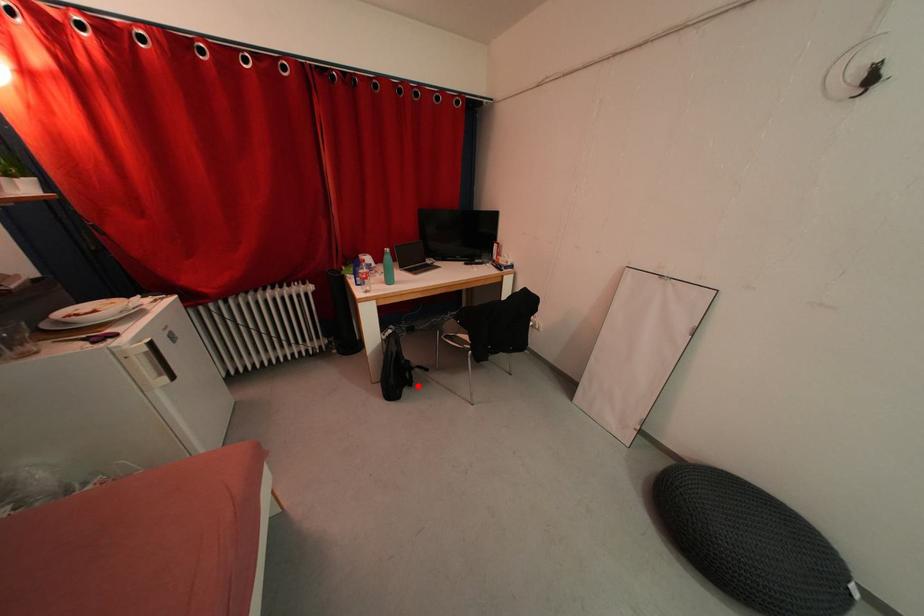
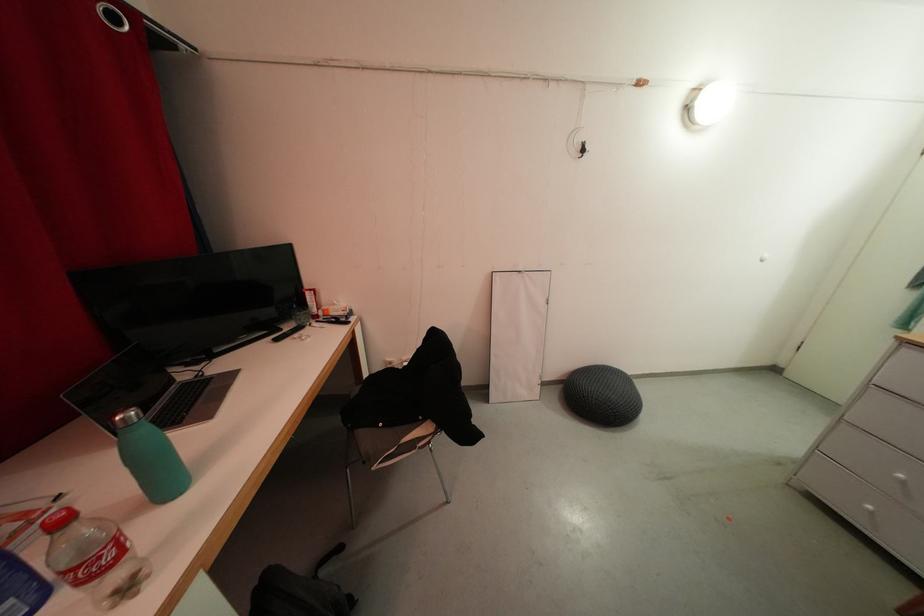
Question: I am providing you with two images of the same scene from different viewpoints. A red point is marked on the first image. At the location where the point appears in image 1, is it still visible in image 2?

Choices:
 (A) Yes
 (B) No

Answer: (A)